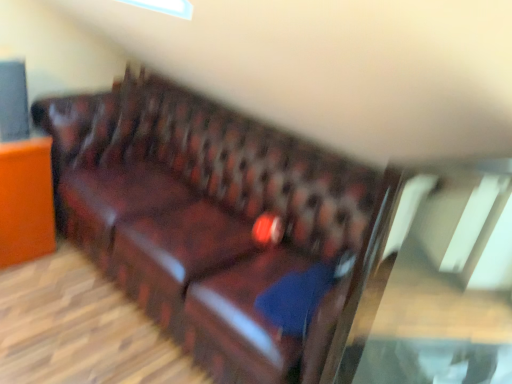
Question: Are matte brown leather sofa at left and leather couch at center far apart?

Choices:
 (A) no
 (B) yes

Answer: (A)

Question: Would you say matte brown leather sofa at left is outside leather couch at center?

Choices:
 (A) yes
 (B) no

Answer: (A)

Question: Is matte brown leather sofa at left at the left side of leather couch at center?

Choices:
 (A) no
 (B) yes

Answer: (B)

Question: Are matte brown leather sofa at left and leather couch at center beside each other?

Choices:
 (A) no
 (B) yes

Answer: (A)

Question: Is leather couch at center a part of matte brown leather sofa at left?

Choices:
 (A) yes
 (B) no

Answer: (B)

Question: Is transparent glass table at center in front of or behind leather couch at center in the image?

Choices:
 (A) front
 (B) behind

Answer: (A)

Question: From the image's perspective, relative to leather couch at center, is transparent glass table at center above or below?

Choices:
 (A) above
 (B) below

Answer: (B)

Question: Is transparent glass table at center wider or thinner than leather couch at center?

Choices:
 (A) wide
 (B) thin

Answer: (B)

Question: Looking at the image, does transparent glass table at center seem bigger or smaller compared to leather couch at center?

Choices:
 (A) big
 (B) small

Answer: (B)

Question: From a real-world perspective, is leather couch at center physically located above or below blue fabric pillow at center?

Choices:
 (A) below
 (B) above

Answer: (A)

Question: Is leather couch at center situated inside blue fabric pillow at center or outside?

Choices:
 (A) inside
 (B) outside

Answer: (B)

Question: In terms of width, does leather couch at center look wider or thinner when compared to blue fabric pillow at center?

Choices:
 (A) thin
 (B) wide

Answer: (B)

Question: Does point (165, 167) appear closer or farther from the camera than point (257, 309)?

Choices:
 (A) farther
 (B) closer

Answer: (A)

Question: In terms of width, does matte brown leather sofa at left look wider or thinner when compared to leather couch at center?

Choices:
 (A) thin
 (B) wide

Answer: (A)

Question: Is point (32, 144) positioned closer to the camera than point (259, 185)?

Choices:
 (A) closer
 (B) farther

Answer: (A)